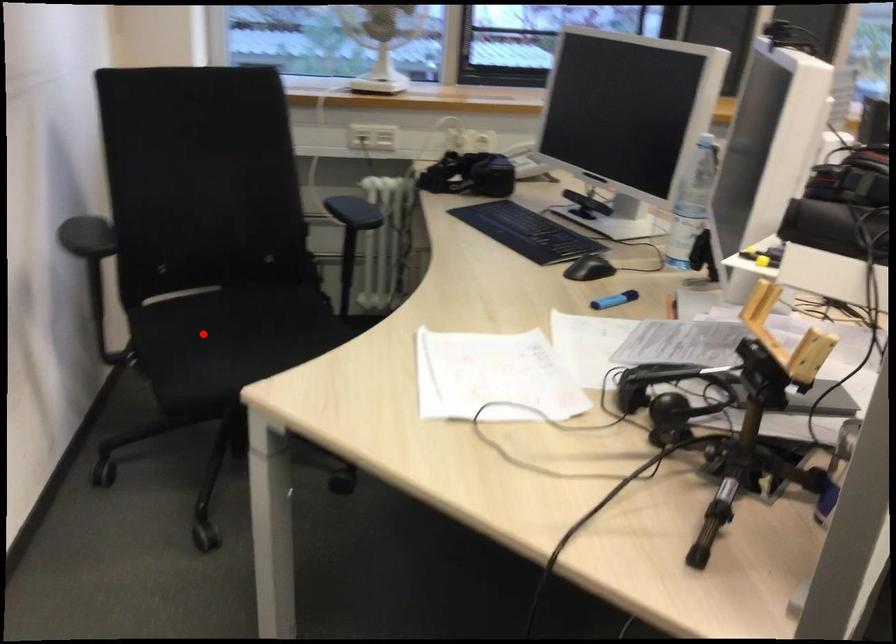
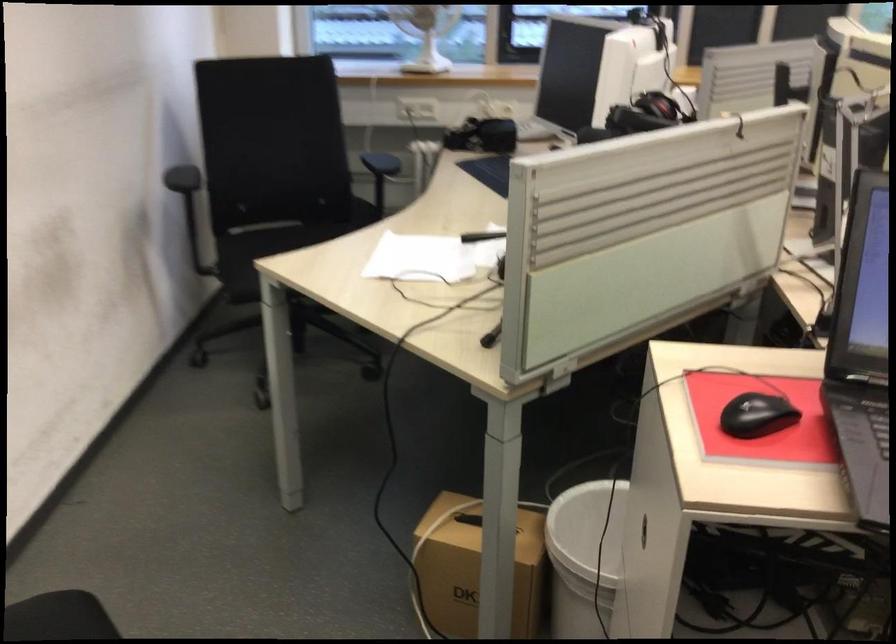
Locate, in the second image, the point that corresponds to the highlighted location in the first image.

(263, 252)